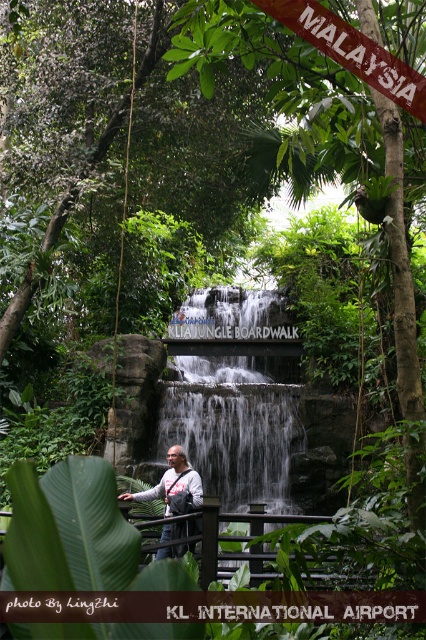
You are a traveler standing at the boardwalk and you have a matte gray backpack at center. You want to take a photo of the white textured water at center. Since the water is lower than your backpack, where should you position your backpack to avoid blocking the view?

The white textured water at center has a lesser height compared to matte gray backpack at center. To avoid blocking the view, move the matte gray backpack at center to the side or behind you so the lower white textured water at center is visible.

You are standing at point (210, 369) in the KLIA Jungle Boardwalk. You want to take a photo of the waterfall. The camera you have can capture objects up to 15 meters away. Will you be able to take a clear photo of the waterfall with your current position?

The distance between point (210, 369) and the camera is 15.83 meters. Since the camera can only capture up to 15 meters, you are 0.83 meters beyond the camera range. Therefore, you won not be able to take a clear photo of the waterfall from your current position.

You are a traveler at KL International Airport and you see the white textured water at center and the matte gray backpack at center. Which object is smaller in size?

The white textured water at center is smaller in size compared to the matte gray backpack at center.